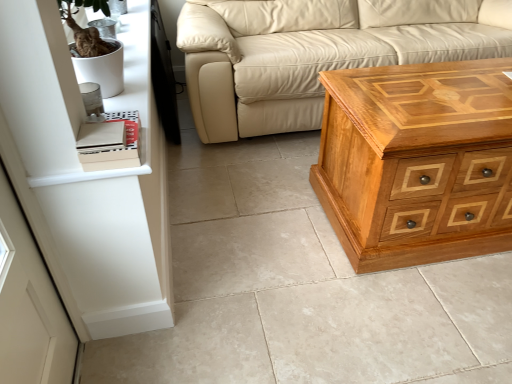
Question: Is polished wood chest of drawers at right thinner than beige leather couch at center?

Choices:
 (A) no
 (B) yes

Answer: (B)

Question: Is polished wood chest of drawers at right surrounding beige leather couch at center?

Choices:
 (A) no
 (B) yes

Answer: (A)

Question: From a real-world perspective, is polished wood chest of drawers at right below beige leather couch at center?

Choices:
 (A) no
 (B) yes

Answer: (B)

Question: Considering the relative positions of polished wood chest of drawers at right and beige leather couch at center in the image provided, is polished wood chest of drawers at right to the right of beige leather couch at center from the viewer's perspective?

Choices:
 (A) yes
 (B) no

Answer: (A)

Question: Does polished wood chest of drawers at right have a lesser height compared to beige leather couch at center?

Choices:
 (A) no
 (B) yes

Answer: (B)

Question: Is polished wood chest of drawers at right bigger or smaller than white matte shelf at upper left?

Choices:
 (A) small
 (B) big

Answer: (B)

Question: Is point (453, 82) positioned closer to the camera than point (22, 61)?

Choices:
 (A) farther
 (B) closer

Answer: (A)

Question: Is polished wood chest of drawers at right taller or shorter than white matte shelf at upper left?

Choices:
 (A) short
 (B) tall

Answer: (B)

Question: From a real-world perspective, is polished wood chest of drawers at right above or below white matte shelf at upper left?

Choices:
 (A) below
 (B) above

Answer: (A)

Question: From the image's perspective, is white matte shelf at upper left above or below beige leather couch at center?

Choices:
 (A) above
 (B) below

Answer: (B)

Question: From a real-world perspective, is white matte shelf at upper left above or below beige leather couch at center?

Choices:
 (A) below
 (B) above

Answer: (B)

Question: Considering the relative positions of white matte shelf at upper left and beige leather couch at center in the image provided, is white matte shelf at upper left to the left or to the right of beige leather couch at center?

Choices:
 (A) left
 (B) right

Answer: (A)

Question: Looking at the image, does white matte shelf at upper left seem bigger or smaller compared to beige leather couch at center?

Choices:
 (A) small
 (B) big

Answer: (A)

Question: Relative to white matte shelf at upper left, is beige leather couch at center in front or behind?

Choices:
 (A) behind
 (B) front

Answer: (A)

Question: From a real-world perspective, relative to white matte shelf at upper left, is beige leather couch at center vertically above or below?

Choices:
 (A) above
 (B) below

Answer: (B)